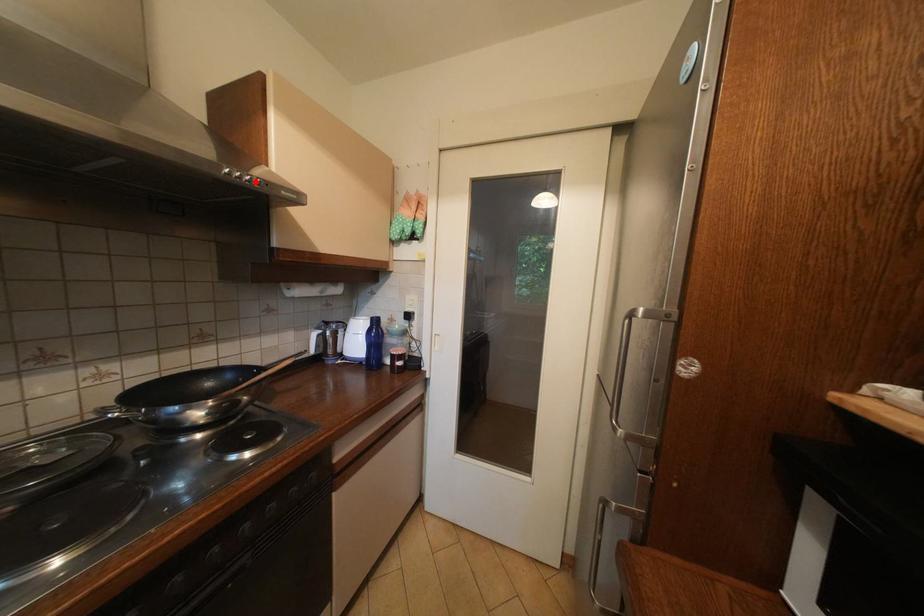
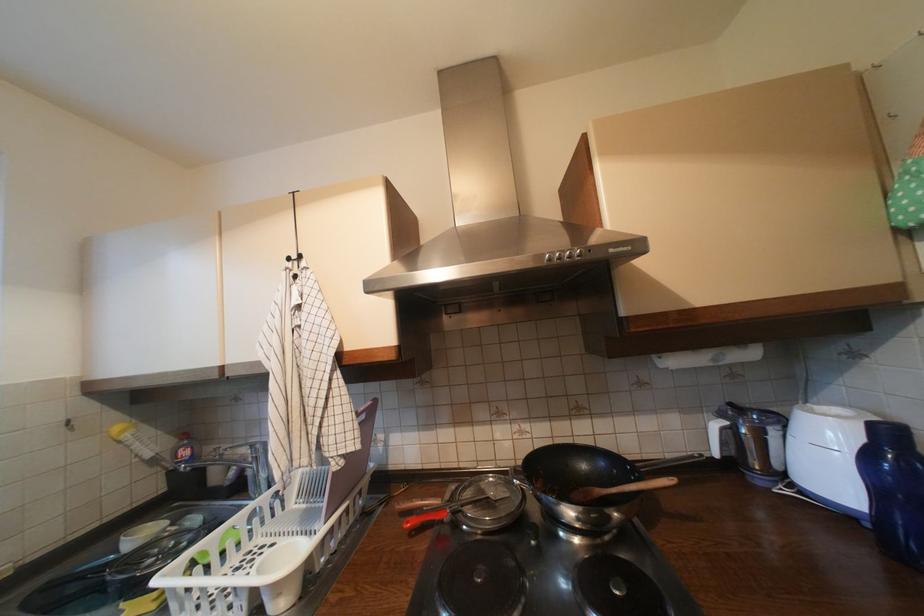
Find the pixel in the second image that matches the highlighted location in the first image.

(577, 257)